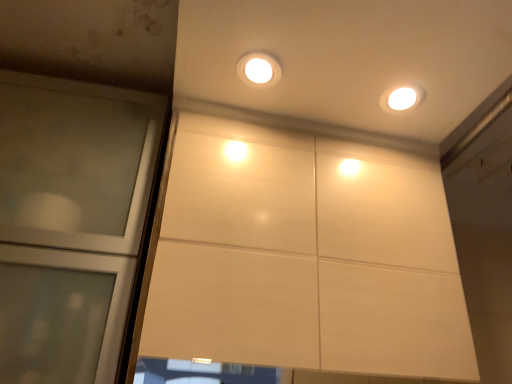
Question: Choose the correct answer: Is matte white light fixture at upper center inside transparent glass door at left or outside it?

Choices:
 (A) inside
 (B) outside

Answer: (B)

Question: From the image's perspective, is matte white light fixture at upper center located above or below transparent glass door at left?

Choices:
 (A) below
 (B) above

Answer: (B)

Question: From a real-world perspective, relative to transparent glass door at left, is matte white light fixture at upper center vertically above or below?

Choices:
 (A) below
 (B) above

Answer: (B)

Question: From the image's perspective, relative to matte white light fixture at upper center, is transparent glass door at left above or below?

Choices:
 (A) below
 (B) above

Answer: (A)

Question: Is transparent glass door at left to the left or to the right of matte white light fixture at upper center in the image?

Choices:
 (A) left
 (B) right

Answer: (A)

Question: Is transparent glass door at left wider or thinner than matte white light fixture at upper center?

Choices:
 (A) thin
 (B) wide

Answer: (B)

Question: Is point (112, 137) positioned closer to the camera than point (268, 79)?

Choices:
 (A) farther
 (B) closer

Answer: (A)